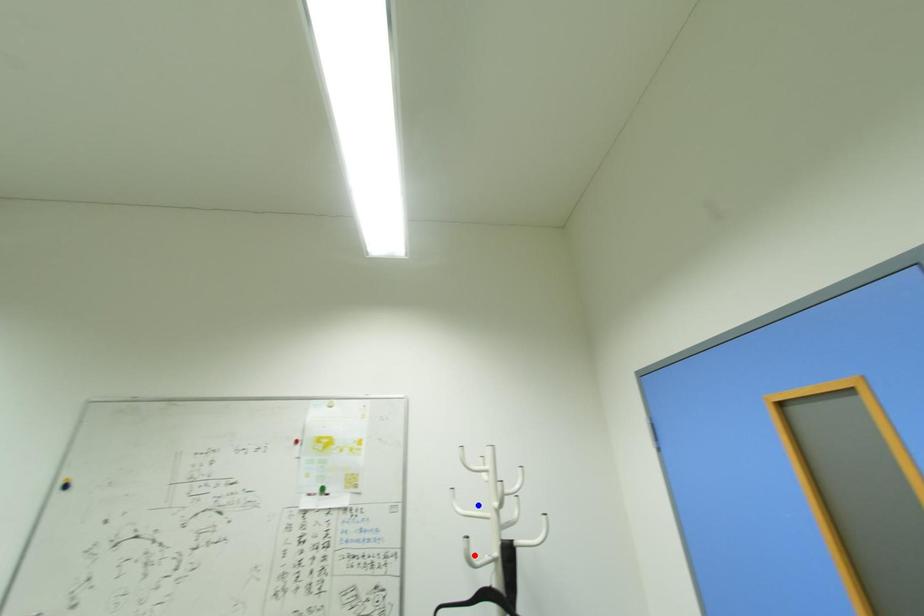
Question: Two points are marked on the image. Which point is closer to the camera?

Choices:
 (A) Blue point is closer.
 (B) Red point is closer.

Answer: (B)